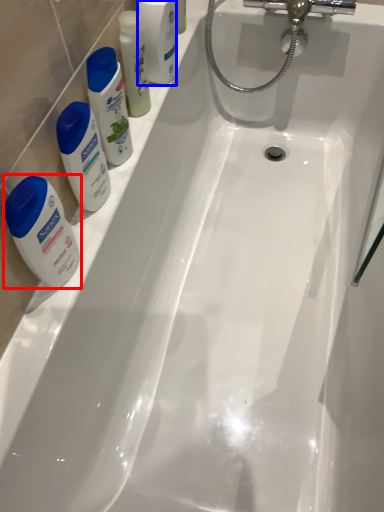
Question: Which object appears farthest to the camera in this image, toiletry (highlighted by a red box) or mouthwash (highlighted by a blue box)?

Choices:
 (A) toiletry
 (B) mouthwash

Answer: (B)